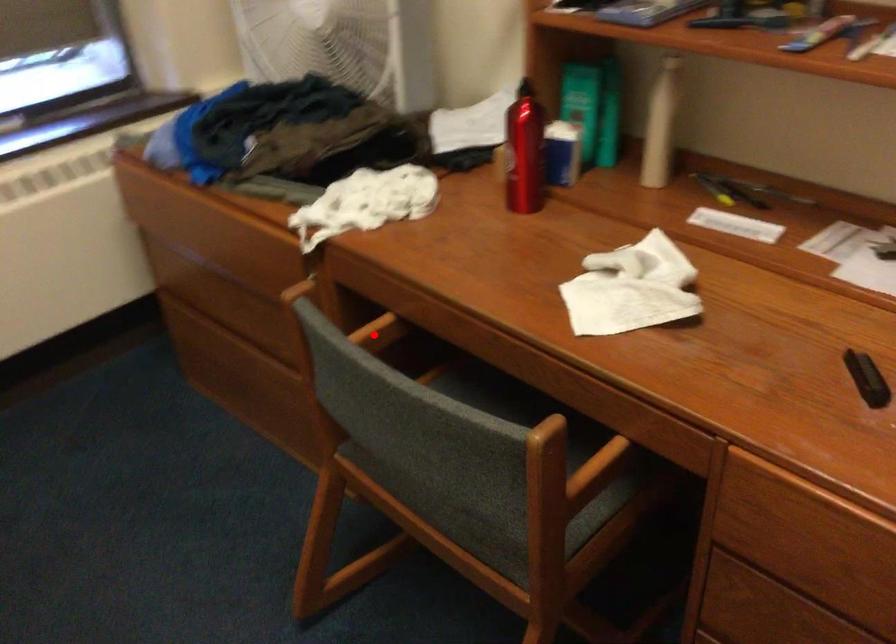
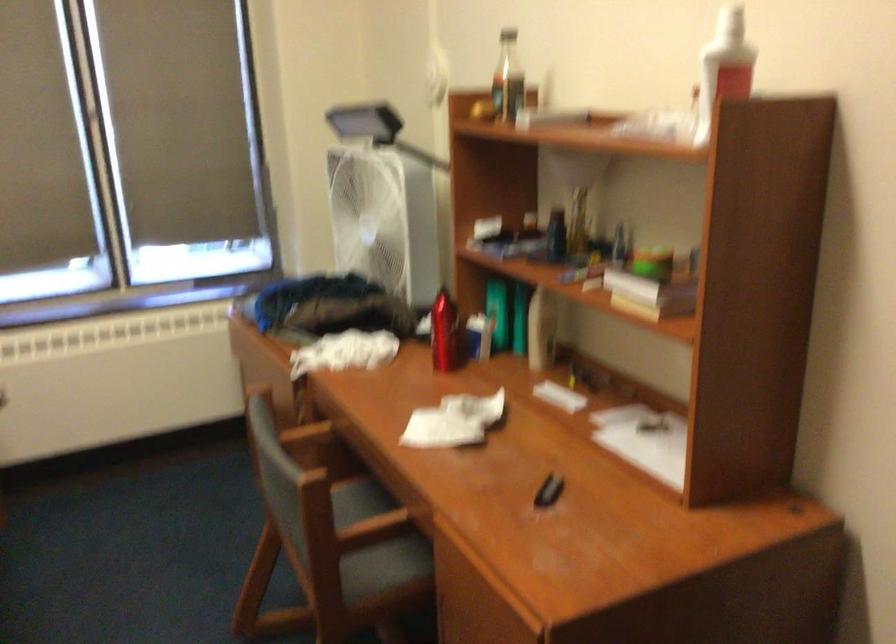
Question: I am providing you with two images of the same scene from different viewpoints. Image1 has a red point marked. In image2, the corresponding 3D location appears at what relative position? Reply with the corresponding letter.

Choices:
 (A) Closer
 (B) Farther

Answer: (B)